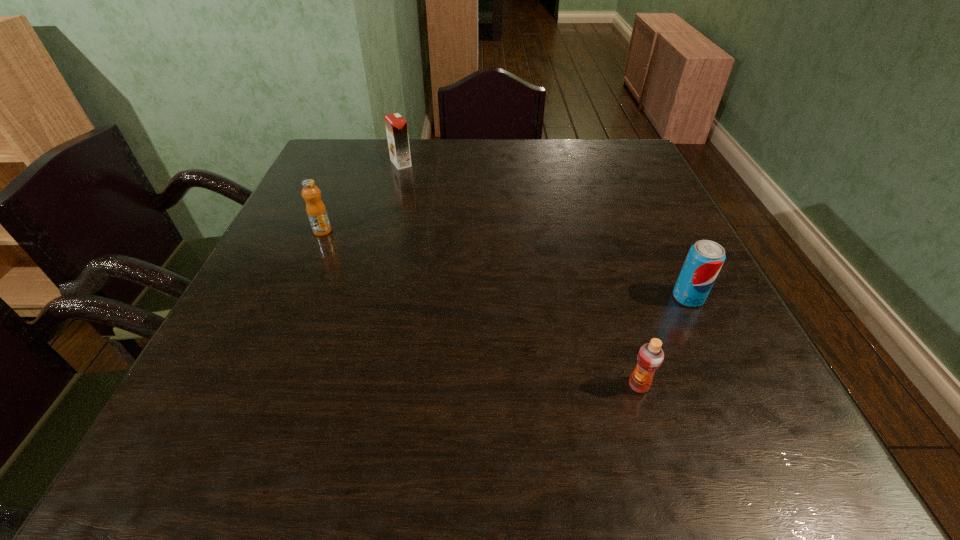
Where is `the second orange juice from right to left`? The width and height of the screenshot is (960, 540). the second orange juice from right to left is located at coordinates (396, 126).

Locate an element on the screen. the farthest object is located at coordinates (396, 126).

This screenshot has height=540, width=960. Find the location of `the second farthest object`. the second farthest object is located at coordinates (316, 211).

I want to click on the second nearest orange juice, so click(x=316, y=211).

Where is `the second nearest object`? Image resolution: width=960 pixels, height=540 pixels. the second nearest object is located at coordinates (705, 258).

You are a GUI agent. You are given a task and a screenshot of the screen. Output one action in this format:
    pyautogui.click(x=<x>, y=<y>)
    Task: Click on the rightmost object
    Image resolution: width=960 pixels, height=540 pixels.
    Given the screenshot: What is the action you would take?
    pyautogui.click(x=705, y=258)

Where is `the nearest object`? This screenshot has width=960, height=540. the nearest object is located at coordinates tap(650, 356).

Locate an element on the screen. This screenshot has width=960, height=540. the shortest orange juice is located at coordinates (650, 356).

Identify the location of vacant space situated on the right of the third object from right to left. Image resolution: width=960 pixels, height=540 pixels. (441, 163).

This screenshot has width=960, height=540. Identify the location of vacant region located 0.340m on the front label of the leftmost orange juice. (269, 356).